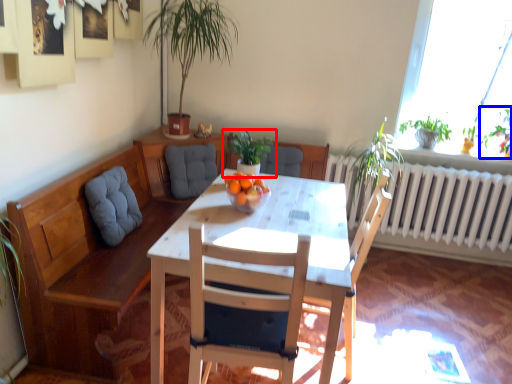
Question: Which object appears farthest to the camera in this image, houseplant (highlighted by a red box) or plant (highlighted by a blue box)?

Choices:
 (A) houseplant
 (B) plant

Answer: (B)